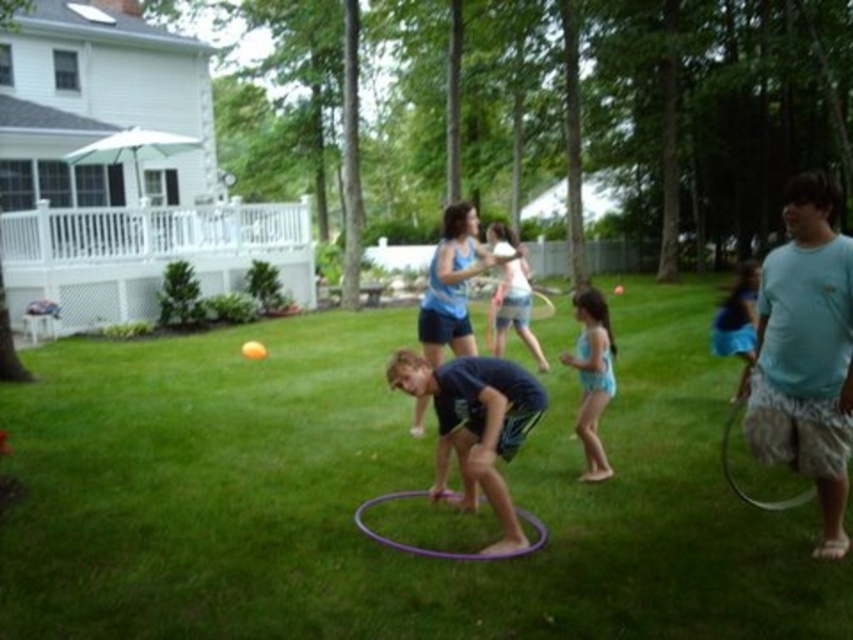
Measure the distance from green grass at center to dark blue fabric at center.

green grass at center and dark blue fabric at center are 4.72 feet apart from each other.

Who is positioned more to the right, green grass at center or dark blue fabric at center?

dark blue fabric at center is more to the right.

Where is `green grass at center`? This screenshot has height=640, width=853. green grass at center is located at coordinates (381, 492).

Find the location of `green grass at center`. green grass at center is located at coordinates (381, 492).

Is purple plastic hula hoop at right wider than blue fabric dress at lower right?

In fact, purple plastic hula hoop at right might be narrower than blue fabric dress at lower right.

Is purple plastic hula hoop at right to the right of blue fabric dress at lower right from the viewer's perspective?

No, purple plastic hula hoop at right is not to the right of blue fabric dress at lower right.

What do you see at coordinates (758, 470) in the screenshot? The height and width of the screenshot is (640, 853). I see `purple plastic hula hoop at right` at bounding box center [758, 470].

The image size is (853, 640). What are the coordinates of `purple plastic hula hoop at right` in the screenshot? It's located at (758, 470).

Can you confirm if light blue t-shirt at center is wider than blue fabric swimsuit at center?

No.

Can you confirm if light blue t-shirt at center is bigger than blue fabric swimsuit at center?

Actually, light blue t-shirt at center might be smaller than blue fabric swimsuit at center.

Who is more forward, (763,387) or (596,406)?

Positioned in front is point (763,387).

Locate an element on the screen. The width and height of the screenshot is (853, 640). light blue t-shirt at center is located at coordinates (805, 353).